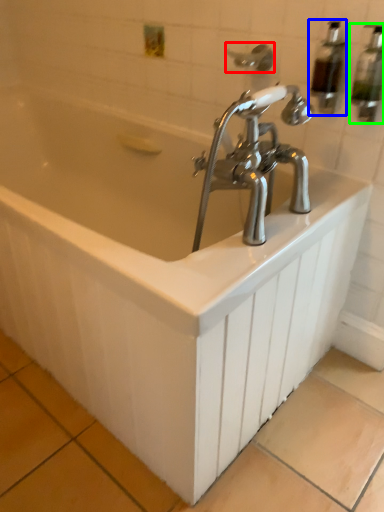
Question: Which object is positioned farthest from shower (highlighted by a red box)? Select from soap dispenser (highlighted by a blue box) and soap dispenser (highlighted by a green box).

Choices:
 (A) soap dispenser
 (B) soap dispenser

Answer: (B)